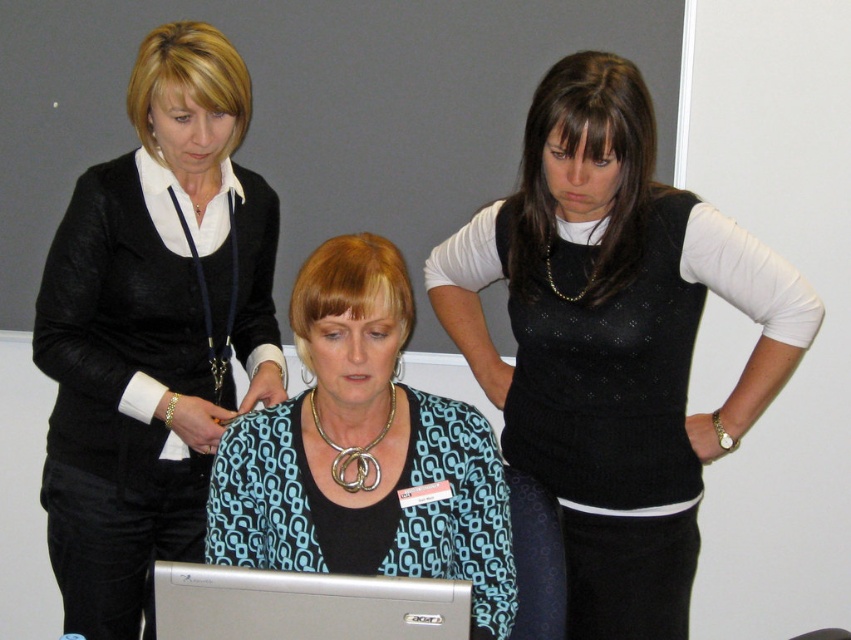
Question: Is black knitted vest at center above blue patterned blouse at center?

Choices:
 (A) no
 (B) yes

Answer: (B)

Question: Which object appears farthest from the camera in this image?

Choices:
 (A) black matte blazer at upper left
 (B) blue patterned blouse at center

Answer: (A)

Question: Estimate the real-world distances between objects in this image. Which object is farther from the black matte blazer at upper left?

Choices:
 (A) blue patterned blouse at center
 (B) silver metallic laptop at center

Answer: (B)

Question: Can you confirm if black matte blazer at upper left is positioned above blue patterned blouse at center?

Choices:
 (A) yes
 (B) no

Answer: (A)

Question: Based on their relative distances, which object is nearer to the blue patterned blouse at center?

Choices:
 (A) black knitted vest at center
 (B) black matte blazer at upper left

Answer: (A)

Question: Does black matte blazer at upper left appear on the left side of blue patterned blouse at center?

Choices:
 (A) yes
 (B) no

Answer: (A)